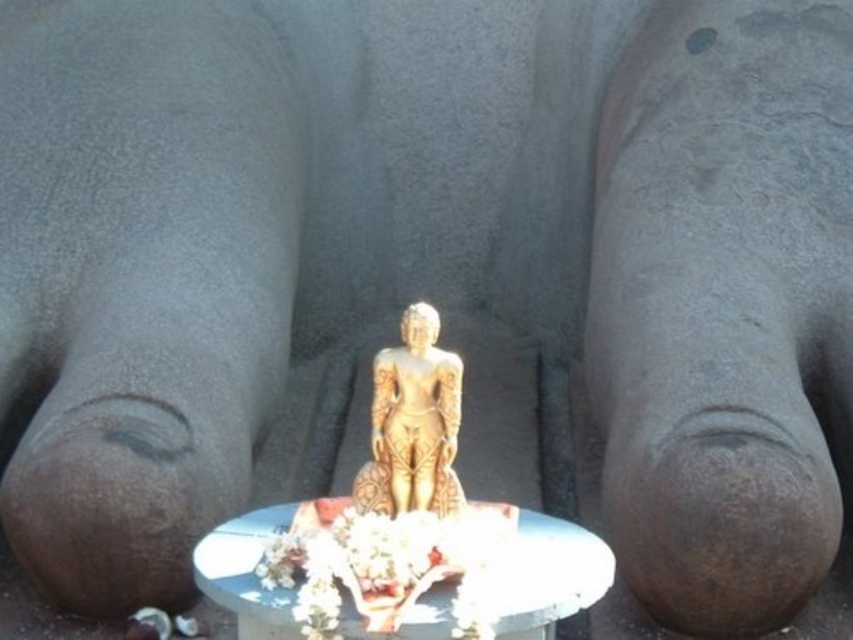
You are a visitor at this sacred site and want to place a small offering on the table. Given that the gold polished statue at center is in the way, can you still place your offering on the white glossy table at center without moving the statue?

The white glossy table at center has a larger size compared to gold polished statue at center, so there is enough space around the statue to place your offering on the table without moving it.

You are standing in front of the large stone sculpture and see the white glossy table at center and the gold polished statue at center. Which object is positioned to the left of the other?

The white glossy table at center is to the left of the gold polished statue at center.